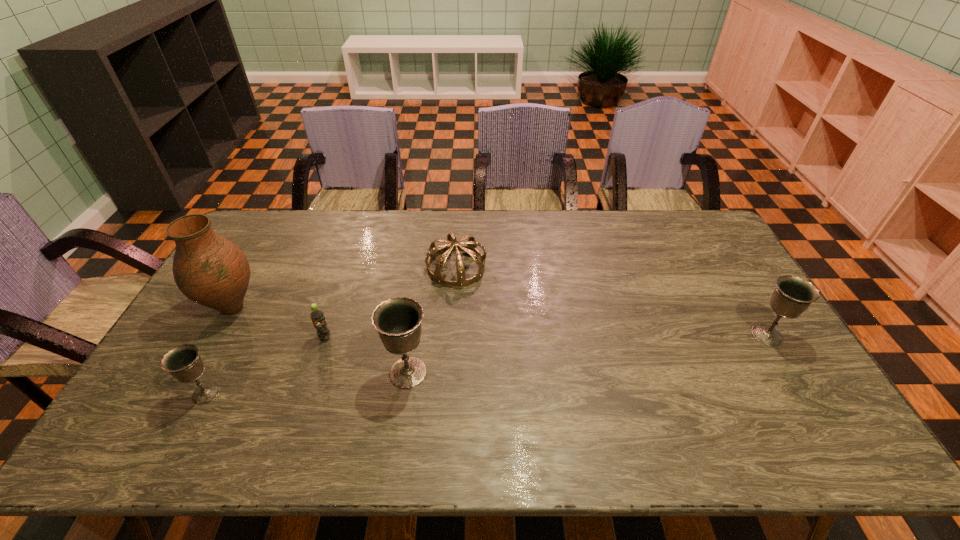
Locate an element on the screen. This screenshot has width=960, height=540. the shortest chalice is located at coordinates (183, 362).

The width and height of the screenshot is (960, 540). Identify the location of the second chalice from right to left. (398, 320).

At what (x,y) coordinates should I click in order to perform the action: click on the fifth shortest object. Please return your answer as a coordinate pair (x, y). The image size is (960, 540). Looking at the image, I should click on (398, 320).

Image resolution: width=960 pixels, height=540 pixels. Find the location of `the rightmost chalice`. the rightmost chalice is located at coordinates (793, 295).

The width and height of the screenshot is (960, 540). In order to click on the second tallest chalice in this screenshot , I will do `click(793, 295)`.

The image size is (960, 540). Find the location of `soda`. soda is located at coordinates (317, 315).

I want to click on tiara, so click(471, 248).

The width and height of the screenshot is (960, 540). Identify the location of the tallest object. (210, 270).

This screenshot has width=960, height=540. I want to click on free spot located on the back of the leftmost chalice, so click(x=245, y=320).

Locate an element on the screen. This screenshot has height=540, width=960. free region located on the left of the tallest chalice is located at coordinates (242, 373).